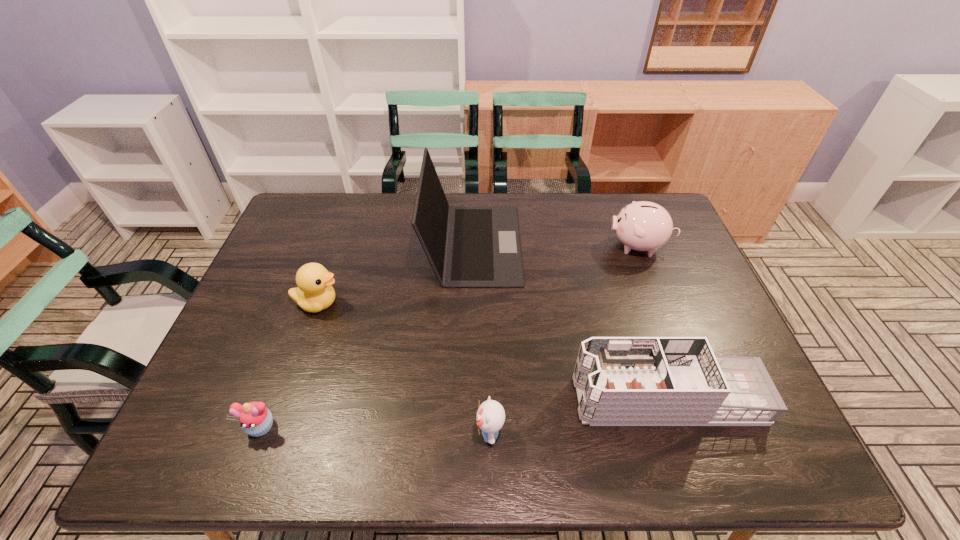
I want to click on duck situated at the left edge, so click(314, 293).

Where is `cupcake positioned at the left edge`? The height and width of the screenshot is (540, 960). cupcake positioned at the left edge is located at coordinates (255, 419).

Identify the location of piggy bank that is at the right edge. (642, 226).

This screenshot has width=960, height=540. I want to click on dollhouse that is at the right edge, so click(620, 381).

Where is `object at the near left corner`? object at the near left corner is located at coordinates (255, 419).

Identify the location of object located at the far right corner. (642, 226).

Image resolution: width=960 pixels, height=540 pixels. I want to click on object that is at the near right corner, so click(620, 381).

In the image, there is a desktop. At what (x,y) coordinates should I click in order to perform the action: click on free region at the far edge. Please return your answer as a coordinate pair (x, y). The image size is (960, 540). Looking at the image, I should click on (390, 229).

Identify the location of blank space at the near edge. The image size is (960, 540). (373, 427).

Locate an element on the screen. This screenshot has height=540, width=960. free space at the left edge of the desktop is located at coordinates (277, 271).